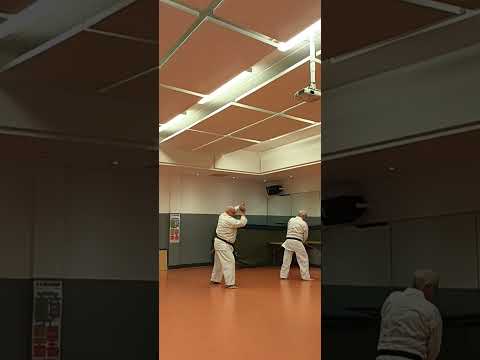
At what (x,y) coordinates should I click in order to perform the action: click on floor. Please return your answer as a coordinate pair (x, y). This screenshot has height=360, width=480. Looking at the image, I should click on (219, 332).